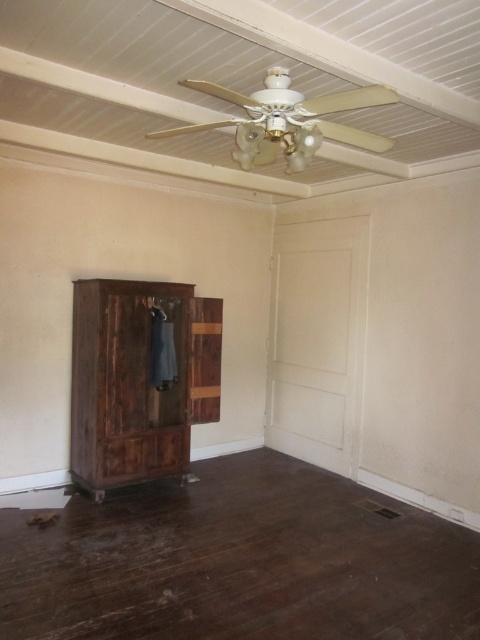
Can you confirm if dark brown wood armoire at left is positioned above denim hanger at left?

Incorrect, dark brown wood armoire at left is not positioned above denim hanger at left.

Is dark brown wood armoire at left further to camera compared to denim hanger at left?

No, it is in front of denim hanger at left.

The width and height of the screenshot is (480, 640). I want to click on dark brown wood armoire at left, so click(x=140, y=380).